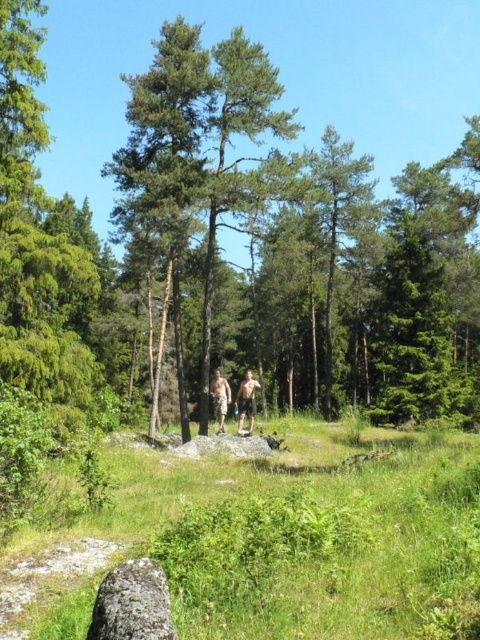
Is green grassy at center closer to camera compared to gray rough rock at lower left?

No, it is not.

Describe the element at coordinates (275, 540) in the screenshot. This screenshot has height=640, width=480. I see `green grassy at center` at that location.

Does point (97, 518) come farther from viewer compared to point (128, 616)?

Yes, it is.

Identify the location of green grassy at center. The image size is (480, 640). (275, 540).

Is point (178, 556) positioned in front of point (215, 384)?

Yes, point (178, 556) is closer to viewer.

Between point (142, 532) and point (215, 380), which one is positioned in front?

Positioned in front is point (142, 532).

The height and width of the screenshot is (640, 480). I want to click on green grassy at center, so click(x=275, y=540).

Does gray rough rock at lower left appear under skinny man at center?

No.

Does gray rough rock at lower left appear over skinny man at center?

Indeed, gray rough rock at lower left is positioned over skinny man at center.

I want to click on gray rough rock at lower left, so click(132, 604).